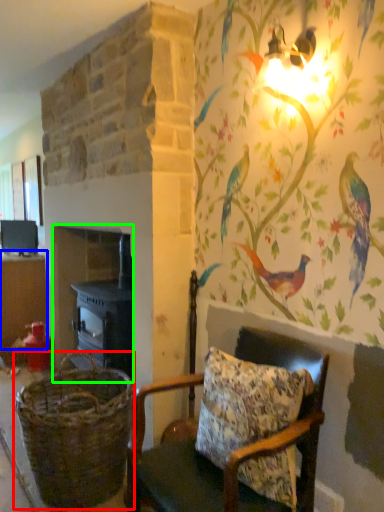
Question: Estimate the real-world distances between objects in this image. Which object is closer to basket (highlighted by a red box), table (highlighted by a blue box) or fireplace (highlighted by a green box)?

Choices:
 (A) table
 (B) fireplace

Answer: (B)